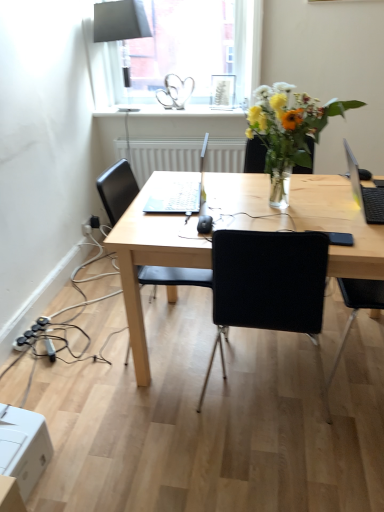
In order to click on vacant space to the right of black plastic mouse at center in this screenshot , I will do `click(269, 214)`.